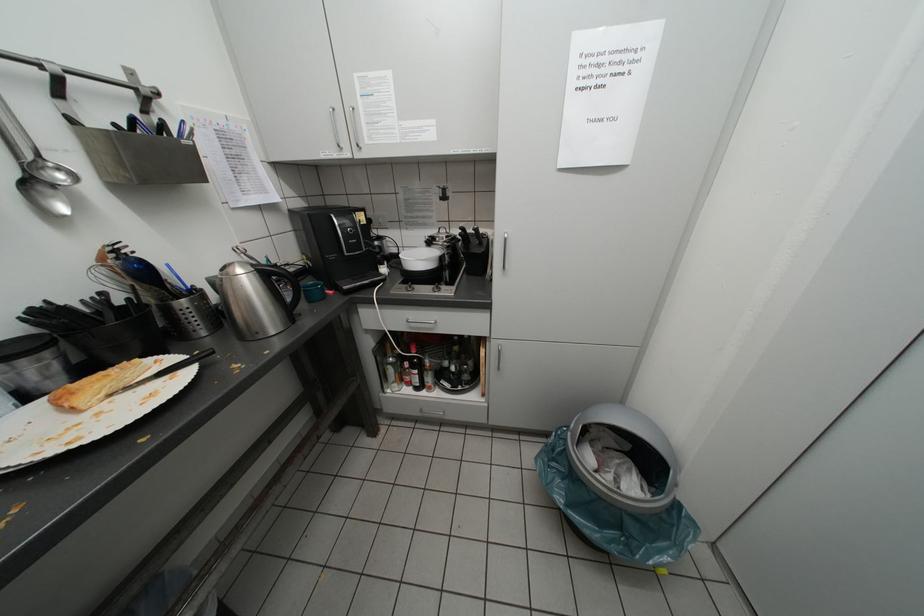
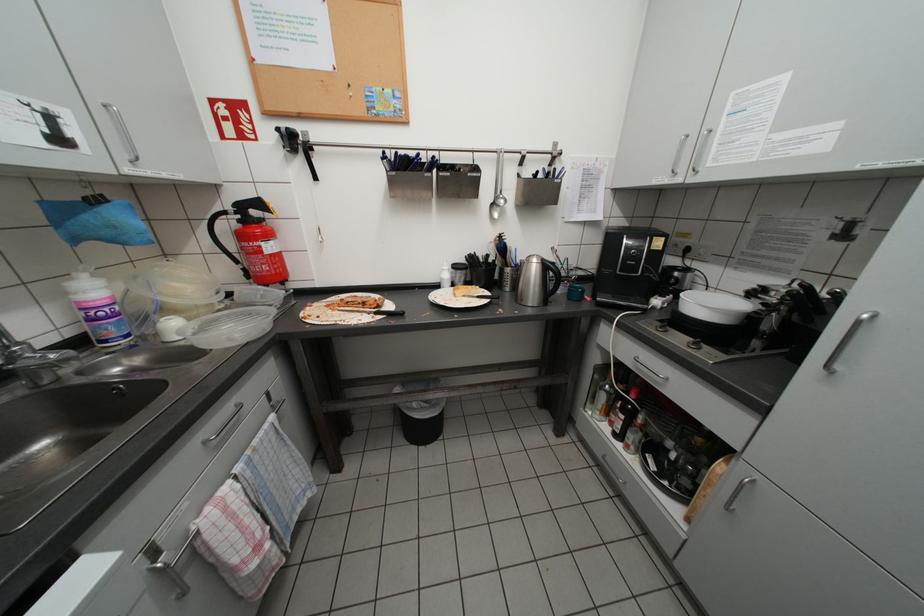
Question: The images are taken continuously from a first-person perspective. In which direction is your viewpoint rotating?

Choices:
 (A) Left
 (B) Right
 (C) Up
 (D) Down

Answer: (A)